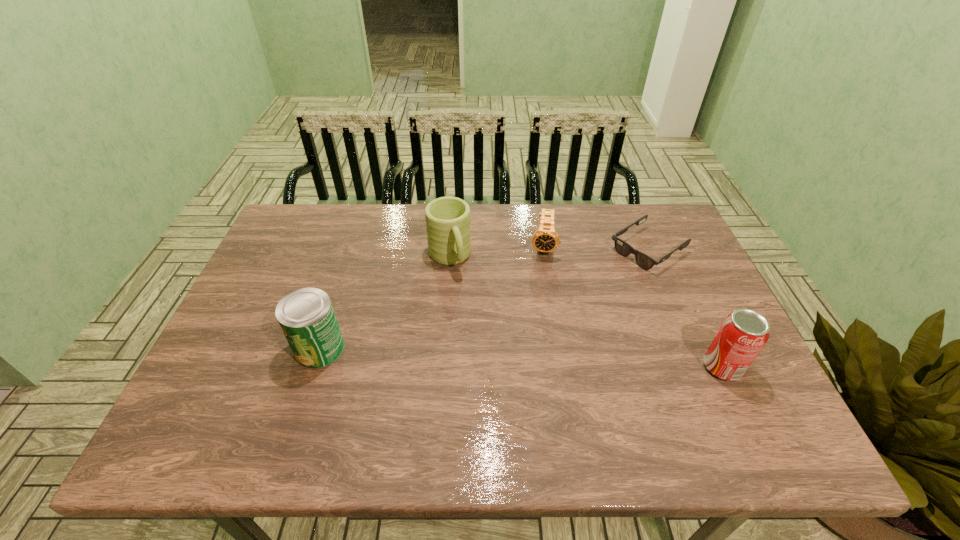
Identify the location of vacant area located on the side of the fourth object from right to left with the handle. (506, 390).

You are a GUI agent. You are given a task and a screenshot of the screen. Output one action in this format:
    pyautogui.click(x=<x>, y=<y>)
    Task: Click on the free space located 0.290m on the temples of the sunglasses
    The width and height of the screenshot is (960, 540).
    Given the screenshot: What is the action you would take?
    pyautogui.click(x=554, y=311)

Locate an element on the screen. This screenshot has width=960, height=540. free location located on the temples of the sunglasses is located at coordinates (538, 321).

Where is `free space located 0.190m on the temples of the sunglasses`? free space located 0.190m on the temples of the sunglasses is located at coordinates (579, 294).

Identify the location of vacant point located on the face of the watch. 541,279.

In order to click on vacant space located 0.320m on the face of the watch in this screenshot , I will do `click(538, 346)`.

Identify the location of free spot located on the face of the watch. The image size is (960, 540). (537, 356).

Where is `mug at the far edge`? The width and height of the screenshot is (960, 540). mug at the far edge is located at coordinates (447, 219).

This screenshot has height=540, width=960. What are the coordinates of `sunglasses that is at the far edge` in the screenshot? It's located at (623, 248).

The width and height of the screenshot is (960, 540). Find the location of `watch positioned at the far edge`. watch positioned at the far edge is located at coordinates (545, 239).